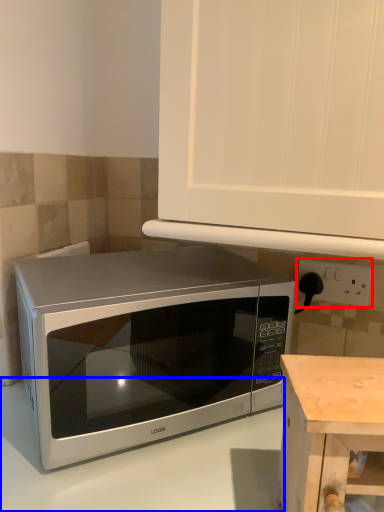
Question: Which of the following is the closest to the observer, electric outlet (highlighted by a red box) or counter top (highlighted by a blue box)?

Choices:
 (A) electric outlet
 (B) counter top

Answer: (B)